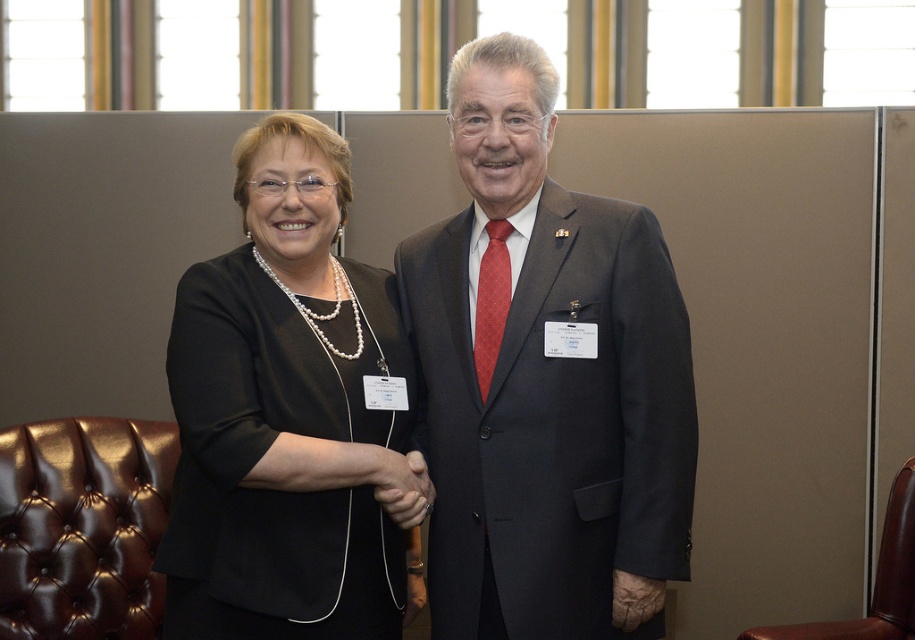
Question: Does matte black suit at center appear over black pearl necklace at center?

Choices:
 (A) no
 (B) yes

Answer: (B)

Question: Based on their relative distances, which object is farther from the brown leather armchair at lower left?

Choices:
 (A) brown leather armchair at right
 (B) matte black suit at center

Answer: (A)

Question: Which point is farther from the camera taking this photo?

Choices:
 (A) (910, 605)
 (B) (145, 516)

Answer: (B)

Question: Can you confirm if matte black suit at center is thinner than black pearl necklace at center?

Choices:
 (A) yes
 (B) no

Answer: (B)

Question: Which point is closer to the camera?

Choices:
 (A) (192, 276)
 (B) (482, 426)
 (C) (887, 528)

Answer: (A)

Question: Is brown leather armchair at lower left positioned at the back of brown leather armchair at right?

Choices:
 (A) no
 (B) yes

Answer: (B)